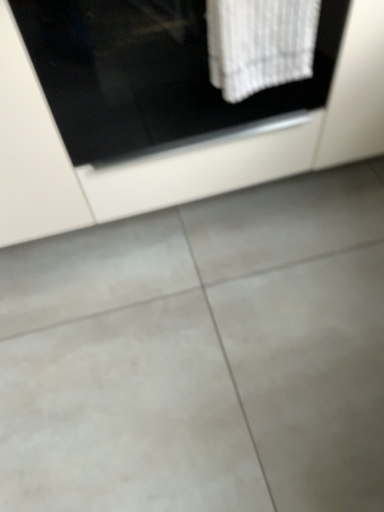
Question: Should I look upward or downward to see white glossy cabinet at upper center?

Choices:
 (A) down
 (B) up

Answer: (B)

Question: Is white textured towel at upper center shorter than white glossy cabinet at upper center?

Choices:
 (A) yes
 (B) no

Answer: (A)

Question: Is white textured towel at upper center next to white glossy cabinet at upper center and touching it?

Choices:
 (A) yes
 (B) no

Answer: (B)

Question: From the image's perspective, is white textured towel at upper center below white glossy cabinet at upper center?

Choices:
 (A) no
 (B) yes

Answer: (B)

Question: Is white textured towel at upper center located outside white glossy cabinet at upper center?

Choices:
 (A) no
 (B) yes

Answer: (B)

Question: From a real-world perspective, is white textured towel at upper center located higher than white glossy cabinet at upper center?

Choices:
 (A) yes
 (B) no

Answer: (A)

Question: Can you confirm if white textured towel at upper center is wider than white glossy cabinet at upper center?

Choices:
 (A) no
 (B) yes

Answer: (A)

Question: Can you confirm if gray tile floor at center is smaller than white glossy cabinet at upper center?

Choices:
 (A) yes
 (B) no

Answer: (A)

Question: Considering the relative sizes of gray tile floor at center and white glossy cabinet at upper center in the image provided, is gray tile floor at center wider than white glossy cabinet at upper center?

Choices:
 (A) no
 (B) yes

Answer: (B)

Question: Considering the relative sizes of gray tile floor at center and white glossy cabinet at upper center in the image provided, is gray tile floor at center thinner than white glossy cabinet at upper center?

Choices:
 (A) no
 (B) yes

Answer: (A)

Question: Is the depth of gray tile floor at center less than that of white glossy cabinet at upper center?

Choices:
 (A) yes
 (B) no

Answer: (B)

Question: Would you consider gray tile floor at center to be distant from white glossy cabinet at upper center?

Choices:
 (A) no
 (B) yes

Answer: (A)

Question: Does gray tile floor at center contain white glossy cabinet at upper center?

Choices:
 (A) no
 (B) yes

Answer: (A)

Question: Is white textured towel at upper center closer to the viewer compared to gray tile floor at center?

Choices:
 (A) no
 (B) yes

Answer: (B)